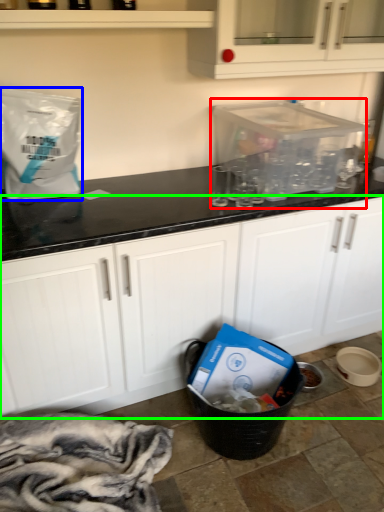
Question: Which object is positioned closest to appliance (highlighted by a red box)? Select from paper bag (highlighted by a blue box) and cabinetry (highlighted by a green box).

Choices:
 (A) paper bag
 (B) cabinetry

Answer: (B)